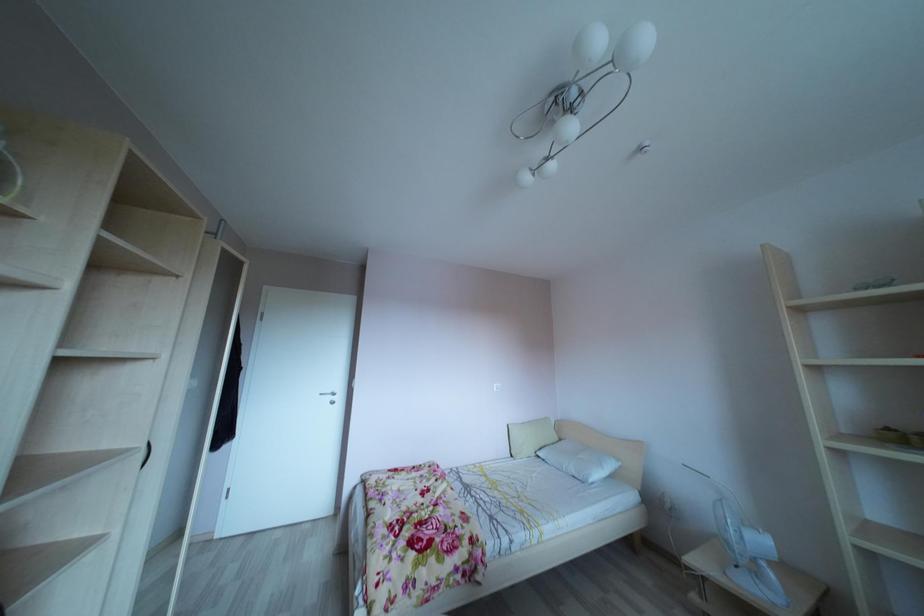
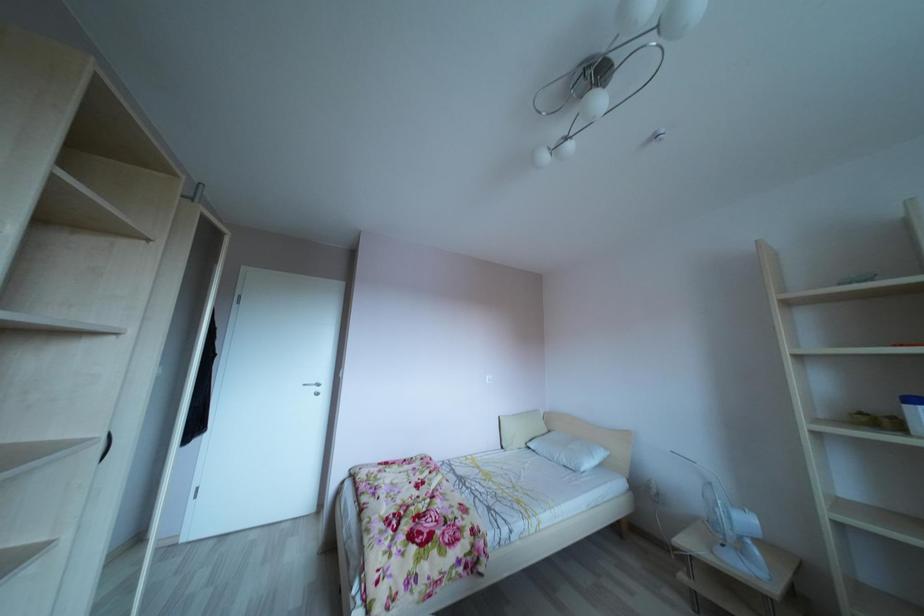
Question: The first image is from the beginning of the video and the second image is from the end. How did the camera likely rotate when shooting the video?

Choices:
 (A) Left
 (B) Right
 (C) Up
 (D) Down

Answer: (B)